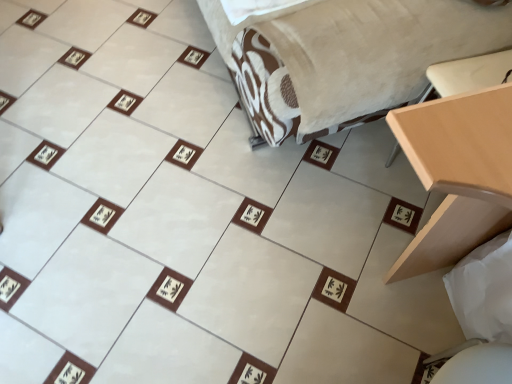
Question: Is light wood table at right not close to white fabric sheet at lower right?

Choices:
 (A) yes
 (B) no

Answer: (B)

Question: Is light wood table at right taller than white fabric sheet at lower right?

Choices:
 (A) yes
 (B) no

Answer: (A)

Question: Considering the relative sizes of light wood table at right and white fabric sheet at lower right in the image provided, is light wood table at right thinner than white fabric sheet at lower right?

Choices:
 (A) no
 (B) yes

Answer: (A)

Question: Is light wood table at right further to the viewer compared to white fabric sheet at lower right?

Choices:
 (A) yes
 (B) no

Answer: (B)

Question: Considering the relative sizes of light wood table at right and white fabric sheet at lower right in the image provided, is light wood table at right wider than white fabric sheet at lower right?

Choices:
 (A) no
 (B) yes

Answer: (B)

Question: Visually, is white fabric sheet at lower right positioned to the left or to the right of velvet beige bed at center?

Choices:
 (A) right
 (B) left

Answer: (A)

Question: Considering the positions of white fabric sheet at lower right and velvet beige bed at center in the image, is white fabric sheet at lower right taller or shorter than velvet beige bed at center?

Choices:
 (A) tall
 (B) short

Answer: (B)

Question: Is point (485, 316) closer or farther from the camera than point (400, 36)?

Choices:
 (A) closer
 (B) farther

Answer: (A)

Question: From a real-world perspective, relative to velvet beige bed at center, is white fabric sheet at lower right vertically above or below?

Choices:
 (A) below
 (B) above

Answer: (A)

Question: From a real-world perspective, is light wood table at right positioned above or below velvet beige bed at center?

Choices:
 (A) above
 (B) below

Answer: (B)

Question: Is light wood table at right to the left or to the right of velvet beige bed at center in the image?

Choices:
 (A) right
 (B) left

Answer: (A)

Question: Is light wood table at right wider or thinner than velvet beige bed at center?

Choices:
 (A) wide
 (B) thin

Answer: (B)

Question: Would you say light wood table at right is inside or outside velvet beige bed at center?

Choices:
 (A) outside
 (B) inside

Answer: (A)

Question: Does point (344, 99) appear closer or farther from the camera than point (501, 173)?

Choices:
 (A) closer
 (B) farther

Answer: (B)

Question: From a real-world perspective, is velvet beige bed at center physically located above or below light wood table at right?

Choices:
 (A) below
 (B) above

Answer: (B)